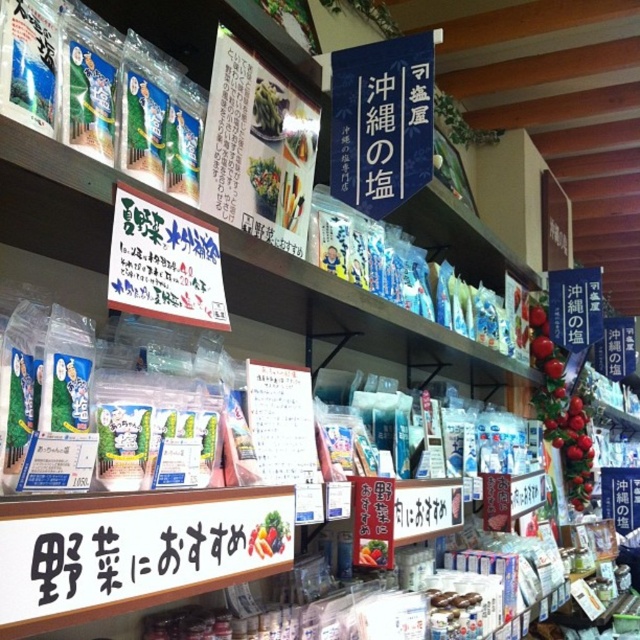
You are a customer in the shop and want to compare the widths of the blue paper sign at upper center and the black plastic sign at lower center. Based on the available information, can you determine which one is wider?

The blue paper sign at upper center might be wider than black plastic sign at lower center according to the description.